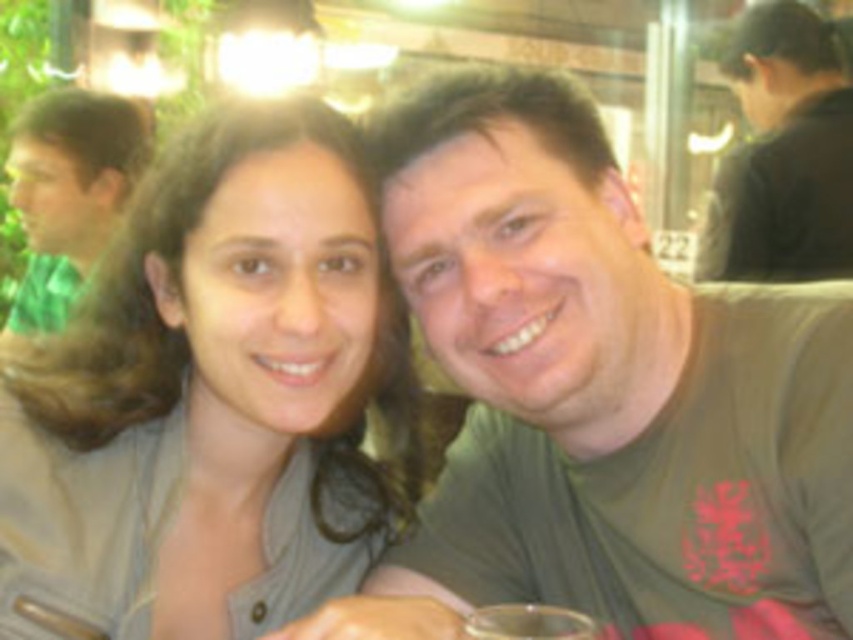
Question: Which point appears closest to the camera in this image?

Choices:
 (A) [x=759, y=380]
 (B) [x=344, y=240]

Answer: (B)

Question: Is matte gray shirt at center below dark brown hair at upper right?

Choices:
 (A) no
 (B) yes

Answer: (B)

Question: Which of these objects is positioned closest to the dark brown hair at upper right?

Choices:
 (A) green matte shirt at left
 (B) green matte shirt at center

Answer: (A)

Question: Can you confirm if green matte shirt at center is positioned below clear plastic cup at center?

Choices:
 (A) yes
 (B) no

Answer: (B)

Question: Does matte gray shirt at center have a greater width compared to dark brown hair at upper right?

Choices:
 (A) yes
 (B) no

Answer: (B)

Question: Based on their relative distances, which object is nearer to the matte gray shirt at center?

Choices:
 (A) green matte shirt at left
 (B) clear plastic cup at center
 (C) dark brown hair at upper right
 (D) green matte shirt at center

Answer: (D)